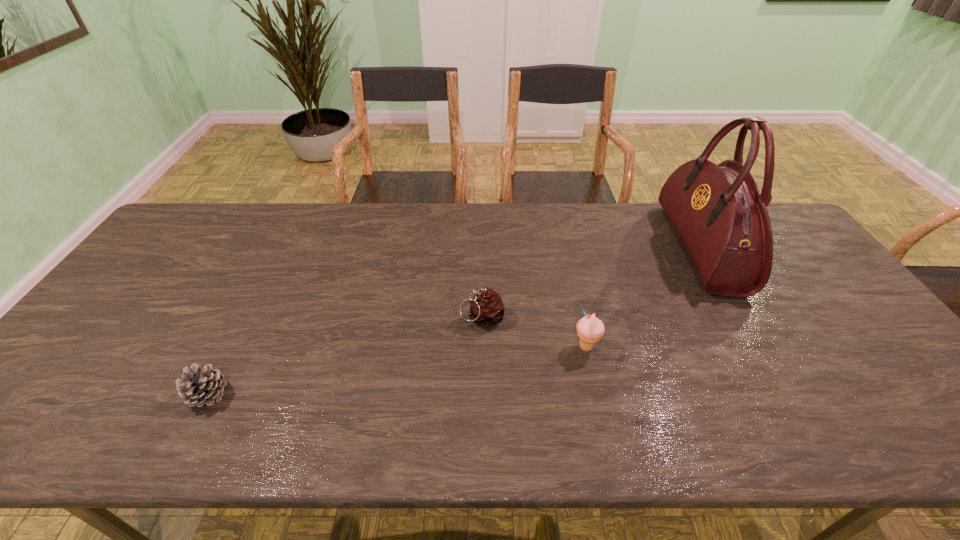
At what (x,y) coordinates should I click in order to perform the action: click on free area in between the nearer pinecone and the handbag. Please return your answer as a coordinate pair (x, y). This screenshot has height=540, width=960. Looking at the image, I should click on coord(455,321).

Where is `empty space between the icecream and the nearer pinecone`? Image resolution: width=960 pixels, height=540 pixels. empty space between the icecream and the nearer pinecone is located at coordinates (397, 370).

Point out which object is positioned as the second nearest to the third nearest object. Please provide its 2D coordinates. Your answer should be formatted as a tuple, i.e. [(x, y)], where the tuple contains the x and y coordinates of a point satisfying the conditions above.

[(199, 386)]

Locate an element on the screen. object that is the nearest to the tallest object is located at coordinates (590, 329).

Find the location of a particular element. The width and height of the screenshot is (960, 540). vacant region that satisfies the following two spatial constraints: 1. on the back side of the icecream; 2. with a leaf charm attached to the third nearest object is located at coordinates (579, 318).

At what (x,y) coordinates should I click in order to perform the action: click on free space that satisfies the following two spatial constraints: 1. with a leaf charm attached to the third object from right to left; 2. on the back side of the second object from right to left. Please return your answer as a coordinate pair (x, y). Image resolution: width=960 pixels, height=540 pixels. Looking at the image, I should click on (483, 347).

At what (x,y) coordinates should I click in order to perform the action: click on free space that satisfies the following two spatial constraints: 1. on the front-facing side of the farthest object; 2. on the front side of the icecream. Please return your answer as a coordinate pair (x, y). Looking at the image, I should click on (758, 347).

At what (x,y) coordinates should I click in order to perform the action: click on vacant region that satisfies the following two spatial constraints: 1. with a leaf charm attached to the icecream; 2. on the left side of the third nearest object. Please return your answer as a coordinate pair (x, y). Looking at the image, I should click on (483, 347).

The height and width of the screenshot is (540, 960). I want to click on free space that satisfies the following two spatial constraints: 1. with a leaf charm attached to the third object from right to left; 2. on the left side of the third farthest object, so click(483, 347).

You are a GUI agent. You are given a task and a screenshot of the screen. Output one action in this format:
    pyautogui.click(x=<x>, y=<y>)
    Task: Click on the free point that satisfies the following two spatial constraints: 1. on the front-facing side of the handbag; 2. on the front side of the third object from left to right
    This screenshot has height=540, width=960.
    Given the screenshot: What is the action you would take?
    (x=758, y=347)